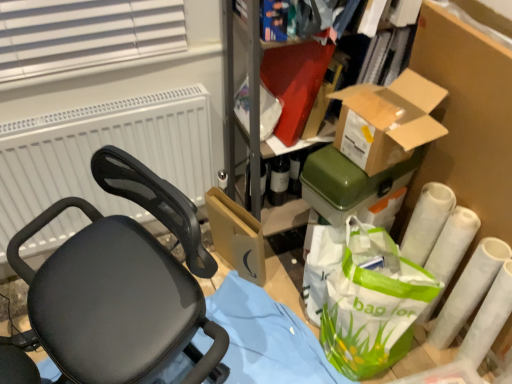
Question: Considering the relative sizes of black mesh chair at left and green plastic container at upper right, the second box when ordered from front to back, in the image provided, is black mesh chair at left bigger than green plastic container at upper right, the second box when ordered from front to back,?

Choices:
 (A) yes
 (B) no

Answer: (A)

Question: From the image's perspective, is black mesh chair at left on green plastic container at upper right, which is the 1th box from back to front?

Choices:
 (A) yes
 (B) no

Answer: (B)

Question: Is black mesh chair at left oriented away from green plastic container at upper right, the second box when ordered from front to back?

Choices:
 (A) no
 (B) yes

Answer: (A)

Question: Would you say black mesh chair at left contains green plastic container at upper right, the second box when ordered from front to back?

Choices:
 (A) yes
 (B) no

Answer: (B)

Question: Can you confirm if black mesh chair at left is smaller than green plastic container at upper right, which is the 1th box from back to front?

Choices:
 (A) no
 (B) yes

Answer: (A)

Question: In terms of width, does green plastic container at upper right, which is the 1th box from back to front, look wider or thinner when compared to black mesh chair at left?

Choices:
 (A) thin
 (B) wide

Answer: (A)

Question: From the image's perspective, is green plastic container at upper right, which is the 1th box from back to front, positioned above or below black mesh chair at left?

Choices:
 (A) above
 (B) below

Answer: (A)

Question: From their relative heights in the image, would you say green plastic container at upper right, the second box when ordered from front to back, is taller or shorter than black mesh chair at left?

Choices:
 (A) short
 (B) tall

Answer: (A)

Question: Considering the relative positions of green plastic container at upper right, the second box when ordered from front to back, and black mesh chair at left in the image provided, is green plastic container at upper right, the second box when ordered from front to back, to the left or to the right of black mesh chair at left?

Choices:
 (A) left
 (B) right

Answer: (B)

Question: Is white matte toilet paper at lower right, acting as the 2th toilet paper starting from the left, situated inside black mesh chair at left or outside?

Choices:
 (A) inside
 (B) outside

Answer: (B)

Question: From a real-world perspective, is white matte toilet paper at lower right, acting as the 2th toilet paper starting from the left, physically located above or below black mesh chair at left?

Choices:
 (A) above
 (B) below

Answer: (B)

Question: Looking at the image, does white matte toilet paper at lower right, the 1th toilet paper when ordered from right to left, seem bigger or smaller compared to black mesh chair at left?

Choices:
 (A) small
 (B) big

Answer: (A)

Question: Considering the positions of white matte toilet paper at lower right, acting as the 2th toilet paper starting from the left, and black mesh chair at left in the image, is white matte toilet paper at lower right, acting as the 2th toilet paper starting from the left, wider or thinner than black mesh chair at left?

Choices:
 (A) thin
 (B) wide

Answer: (A)

Question: Considering the relative positions of black mesh chair at left and brown cardboard box at upper right, acting as the 1th box starting from the front, in the image provided, is black mesh chair at left to the left or to the right of brown cardboard box at upper right, acting as the 1th box starting from the front,?

Choices:
 (A) right
 (B) left

Answer: (B)

Question: From the image's perspective, is black mesh chair at left positioned above or below brown cardboard box at upper right, marked as the second box in a back-to-front arrangement?

Choices:
 (A) above
 (B) below

Answer: (B)